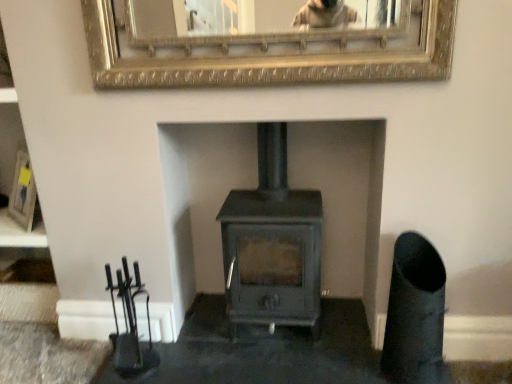
Where is `vacant space situated on the left part of matte gray wood burning stove at center`? The image size is (512, 384). vacant space situated on the left part of matte gray wood burning stove at center is located at coordinates (199, 338).